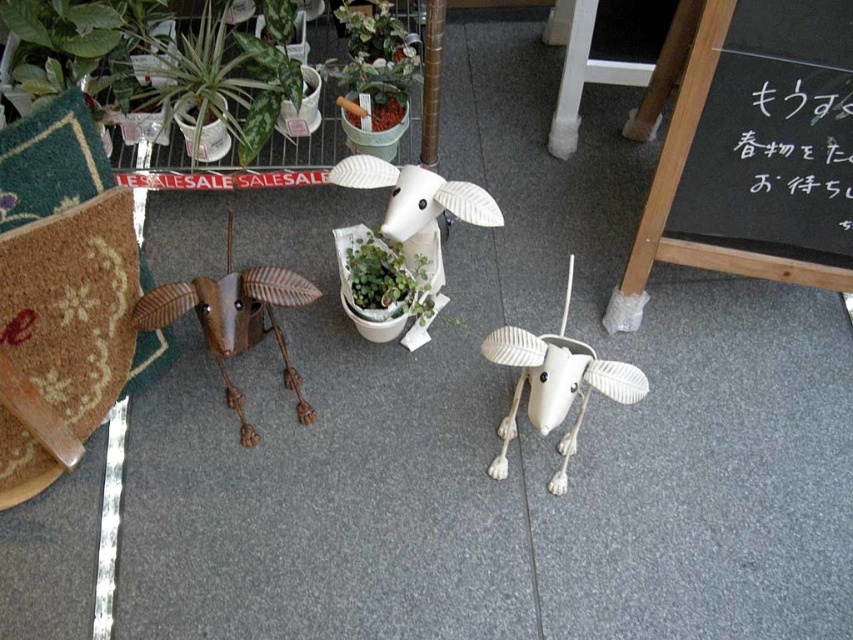
You are a delivery person who needs to place a package on the green glossy plant at upper center. However, the package is 1.5 meters wide. Can you place it there without moving the plant?

The distance between the green glossy plant at upper center and the viewer is 1.36 meters. Since the package is 1.5 meters wide, which is wider than the available space, you cannot place the package there without moving the plant.

You are arranging a shelf and need to place the green glossy plant at upper center and the white matte sheep at center. According to the scene, which object is positioned to the left when viewed from the front?

The green glossy plant at upper center is positioned to the left of the white matte sheep at center.

You are standing in the shop and want to write a note on the black chalkboard at right. Where should you look to find it?

The black chalkboard at right is located at the 2D coordinates point (757, 148), so you should look there to find it.